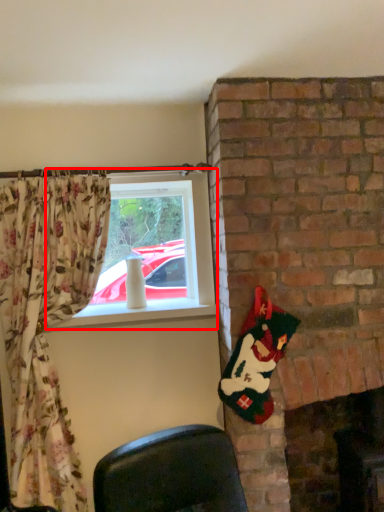
Question: From the image's perspective, what is the correct spatial relationship of window (annotated by the red box) in relation to fireplace?

Choices:
 (A) below
 (B) above

Answer: (B)